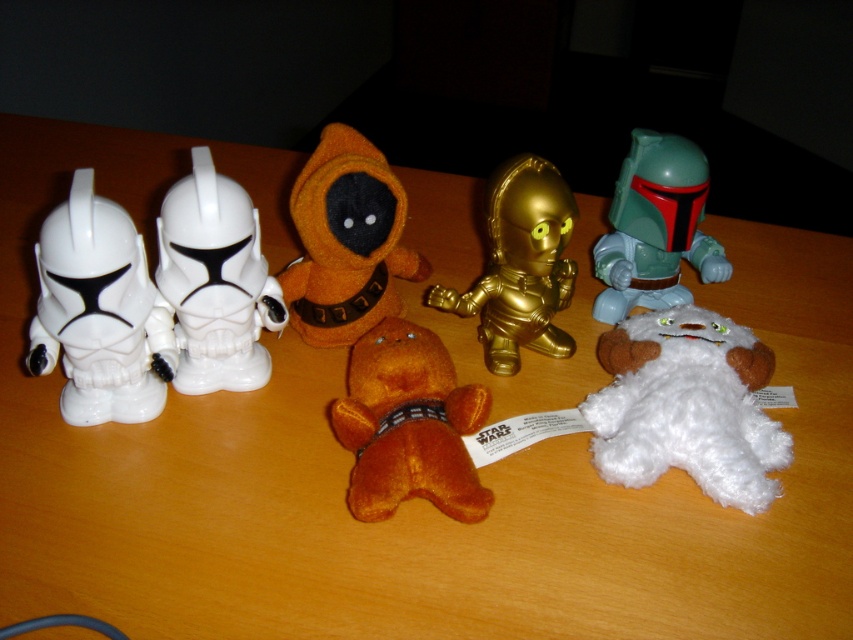
You are looking at the Star Wars display and notice two points marked on the image. The first point is at coordinates point (573,211) and the second point is at point (730,268). Which of these two points is nearer to you?

Point (573,211) is closer to the camera than point (730,268), so the first point is nearer to you.